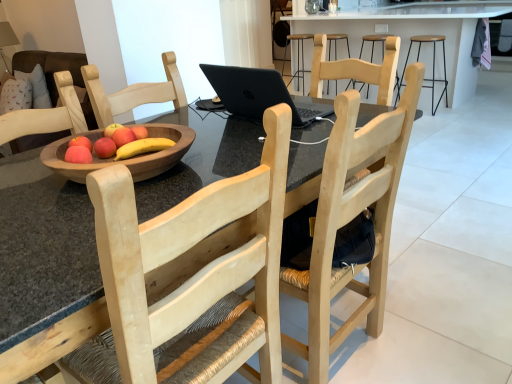
Question: Is the depth of black metal stool at upper right less than that of matte wooden apple at center?

Choices:
 (A) no
 (B) yes

Answer: (A)

Question: Is black metal stool at upper right oriented away from matte wooden apple at center?

Choices:
 (A) no
 (B) yes

Answer: (B)

Question: Is black metal stool at upper right smaller than matte wooden apple at center?

Choices:
 (A) yes
 (B) no

Answer: (B)

Question: From a real-world perspective, is black metal stool at upper right on top of matte wooden apple at center?

Choices:
 (A) yes
 (B) no

Answer: (B)

Question: Is black metal stool at upper right shorter than matte wooden apple at center?

Choices:
 (A) yes
 (B) no

Answer: (B)

Question: Considering the positions of black matte laptop at center and black metal stool at upper right in the image, is black matte laptop at center wider or thinner than black metal stool at upper right?

Choices:
 (A) wide
 (B) thin

Answer: (B)

Question: Based on their sizes in the image, would you say black matte laptop at center is bigger or smaller than black metal stool at upper right?

Choices:
 (A) big
 (B) small

Answer: (B)

Question: From a real-world perspective, relative to black metal stool at upper right, is black matte laptop at center vertically above or below?

Choices:
 (A) above
 (B) below

Answer: (A)

Question: From the image's perspective, is black matte laptop at center above or below black metal stool at upper right?

Choices:
 (A) below
 (B) above

Answer: (A)

Question: Relative to black metal stool at upper right, is metallic black bar stool at center in front or behind?

Choices:
 (A) front
 (B) behind

Answer: (B)

Question: Would you say metallic black bar stool at center is inside or outside black metal stool at upper right?

Choices:
 (A) outside
 (B) inside

Answer: (A)

Question: Is metallic black bar stool at center wider or thinner than black metal stool at upper right?

Choices:
 (A) thin
 (B) wide

Answer: (A)

Question: In terms of size, does metallic black bar stool at center appear bigger or smaller than black metal stool at upper right?

Choices:
 (A) big
 (B) small

Answer: (B)

Question: From the image's perspective, relative to matte wooden apple at center, is black metal stool at upper right above or below?

Choices:
 (A) below
 (B) above

Answer: (B)

Question: Is black metal stool at upper right spatially inside matte wooden apple at center, or outside of it?

Choices:
 (A) outside
 (B) inside

Answer: (A)